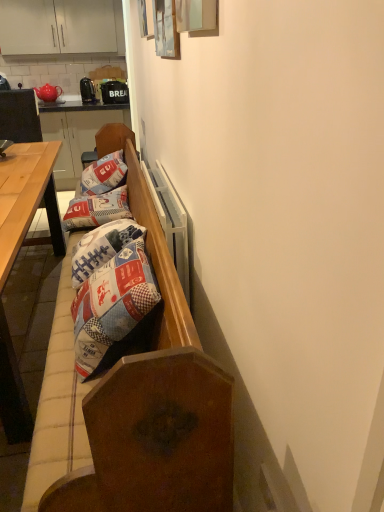
Question: From a real-world perspective, relative to patchwork fabric pillow at center, which is the first pillow from front to back, is wooden bench at left vertically above or below?

Choices:
 (A) below
 (B) above

Answer: (A)

Question: From their relative heights in the image, would you say wooden bench at left is taller or shorter than patchwork fabric pillow at center, positioned as the second pillow in back-to-front order?

Choices:
 (A) tall
 (B) short

Answer: (A)

Question: Considering the real-world distances, which object is farthest from the white matte cabinet at upper left?

Choices:
 (A) light brown wooden table at left
 (B) wooden desk at left
 (C) patchwork fabric pillow at center, which is the first pillow from front to back
 (D) patchwork fabric pillow at center, which is the first pillow in back-to-front order
 (E) metallic black coffee maker at upper left

Answer: (C)

Question: Based on their relative distances, which object is farther from the light brown wooden table at left?

Choices:
 (A) white matte cabinet at upper left
 (B) wooden bench at center
 (C) patchwork fabric pillow at center, the 2th pillow viewed from the front
 (D) wooden bench at left
 (E) matte ceramic teapot at upper left

Answer: (A)